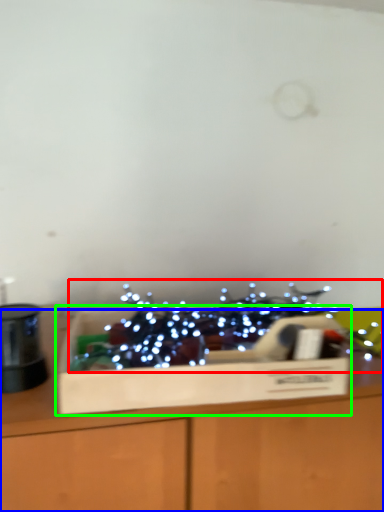
Question: Considering the real-world distances, which object is farthest from christmas decoration (highlighted by a red box)? table (highlighted by a blue box) or cardboard box (highlighted by a green box)?

Choices:
 (A) table
 (B) cardboard box

Answer: (A)